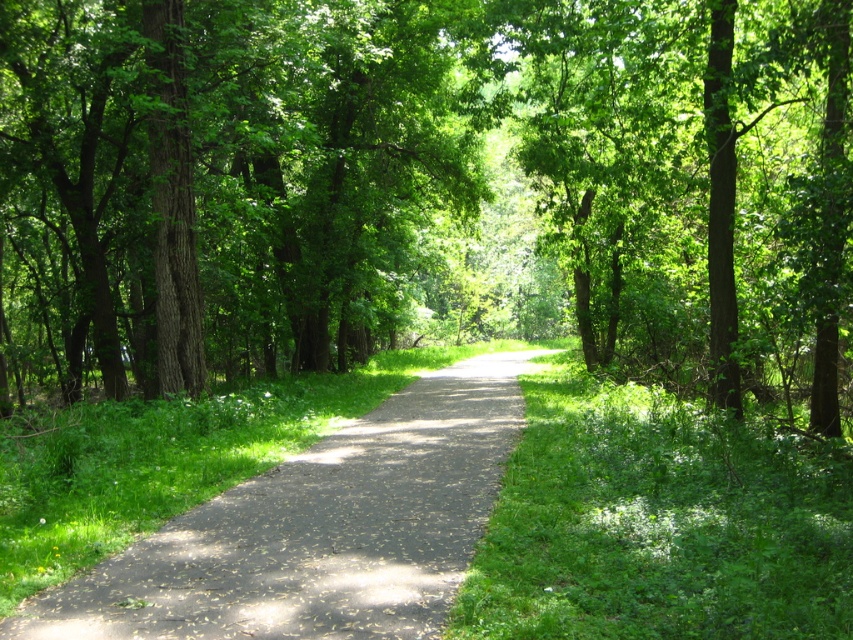
Is point (635, 289) positioned after point (262, 625)?

That is True.

Does green leafy tree at center appear on the right side of dark gray asphalt path at center?

Incorrect, green leafy tree at center is not on the right side of dark gray asphalt path at center.

This screenshot has width=853, height=640. In order to click on green leafy tree at center in this screenshot , I will do `click(426, 189)`.